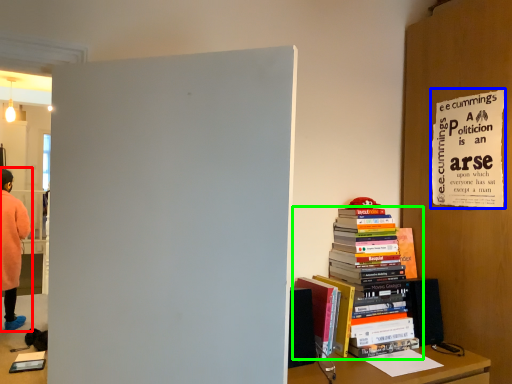
Question: Based on their relative distances, which object is nearer to person (highlighted by a red box)? Choose from poster page (highlighted by a blue box) and book (highlighted by a green box).

Choices:
 (A) poster page
 (B) book

Answer: (B)